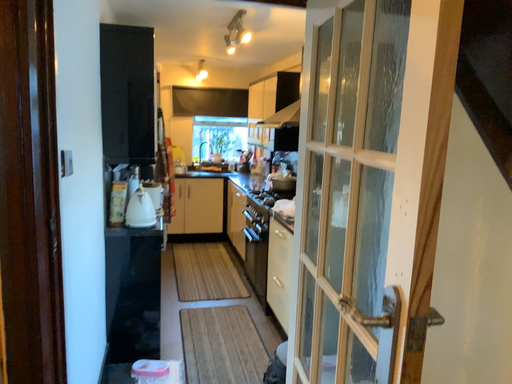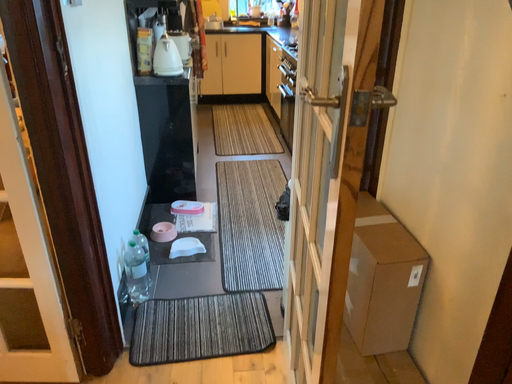
Question: How did the camera likely rotate when shooting the video?

Choices:
 (A) rotated downward
 (B) rotated upward

Answer: (A)